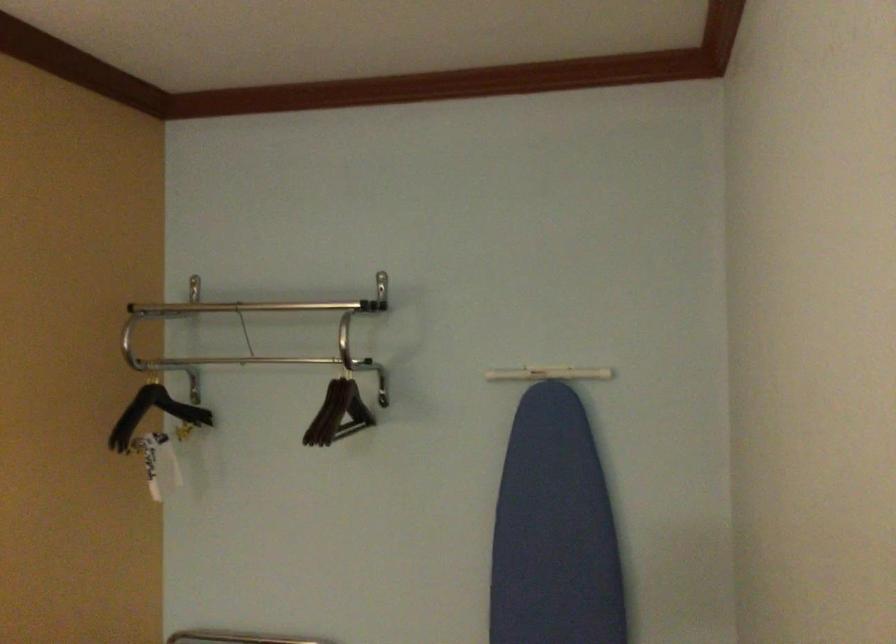
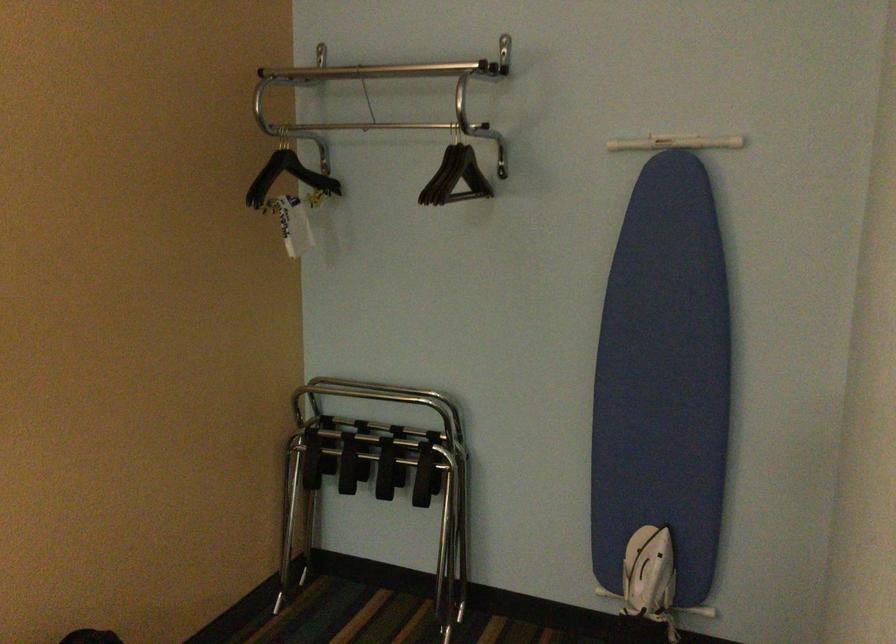
Find the pixel in the second image that matches pixel 341 411 in the first image.

(455, 176)